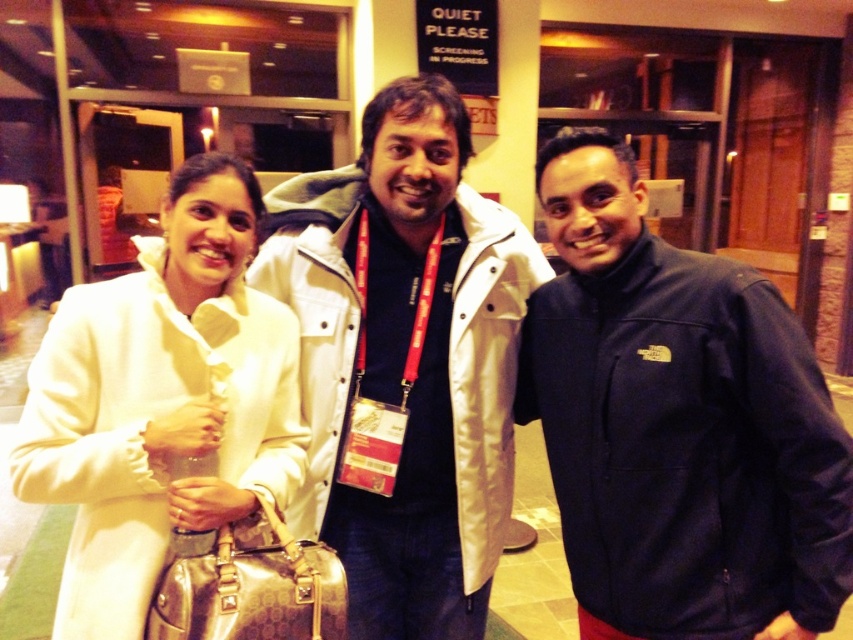
You are a photographer trying to position a light source for a portrait. You have a small spotlight that needs to be placed at point (405,358). Based on the scene description, where should you place the spotlight relative to the white matte jacket at center?

The point (405,358) is on the white matte jacket at center, so you should place the spotlight directly on the white matte jacket at center to illuminate that area.

You are at an event and need to locate two people wearing jackets. The dark blue fleece jacket at center and the white matte jacket at center are both in the scene. Which one is positioned to the right of the other?

The dark blue fleece jacket at center is to the right of the white matte jacket at center.

You are standing in the lobby and need to locate the person wearing the dark blue fleece jacket at center. According to the coordinate system where the bottom left corner is the origin, what are the coordinates of this person?

The dark blue fleece jacket at center is located at coordinates point (x=677, y=422).